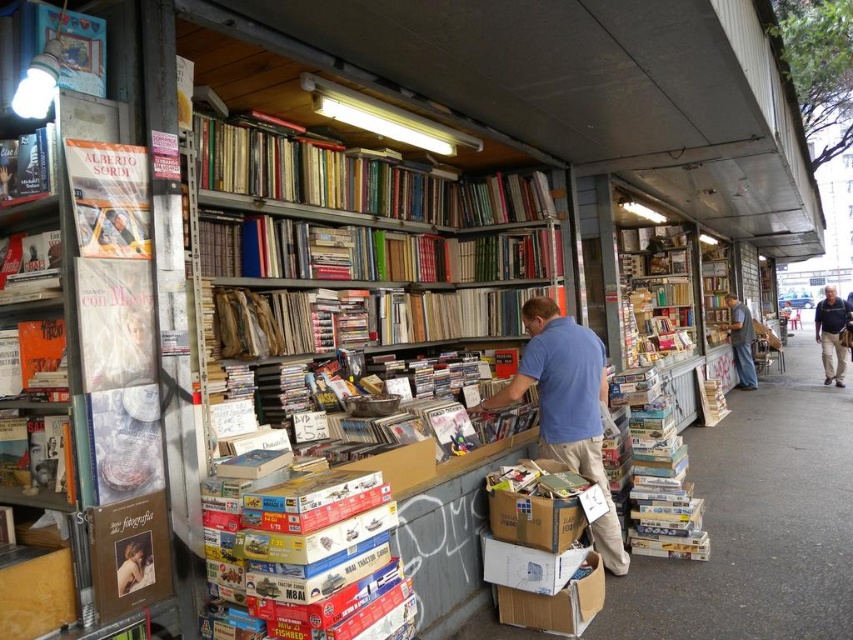
Who is more forward, (740, 316) or (125, 554)?

Point (125, 554)

Can you confirm if denim pants at center is bigger than smooth skin at lower left?

Indeed, denim pants at center has a larger size compared to smooth skin at lower left.

Locate an element on the screen. The image size is (853, 640). denim pants at center is located at coordinates (741, 340).

Who is lower down, hardcover books at right or cardboard box at lower center?

cardboard box at lower center is below.

Who is positioned more to the left, hardcover books at right or cardboard box at lower center?

From the viewer's perspective, cardboard box at lower center appears more on the left side.

The image size is (853, 640). What do you see at coordinates (659, 472) in the screenshot?
I see `hardcover books at right` at bounding box center [659, 472].

Where is `hardcover books at right`? Image resolution: width=853 pixels, height=640 pixels. hardcover books at right is located at coordinates (659, 472).

Does point (637, 532) come behind point (828, 369)?

That is False.

In order to click on hardcover books at right in this screenshot , I will do `click(659, 472)`.

Identify the location of hardcover books at right. (659, 472).